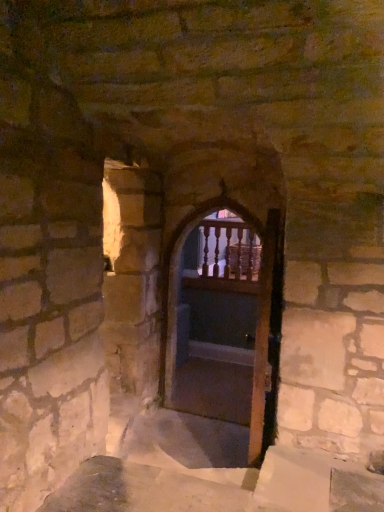
Question: Considering the positions of point pos(256,415) and point pos(278,343), is point pos(256,415) closer or farther from the camera than point pos(278,343)?

Choices:
 (A) closer
 (B) farther

Answer: (B)

Question: From the image's perspective, relative to wooden at center, is wooden screen door at center above or below?

Choices:
 (A) above
 (B) below

Answer: (B)

Question: Which object is positioned farthest from the wooden balusters at center?

Choices:
 (A) wooden at center
 (B) wooden screen door at center

Answer: (B)

Question: Which of these objects is positioned farthest from the wooden balusters at center?

Choices:
 (A) wooden screen door at center
 (B) wooden at center

Answer: (A)